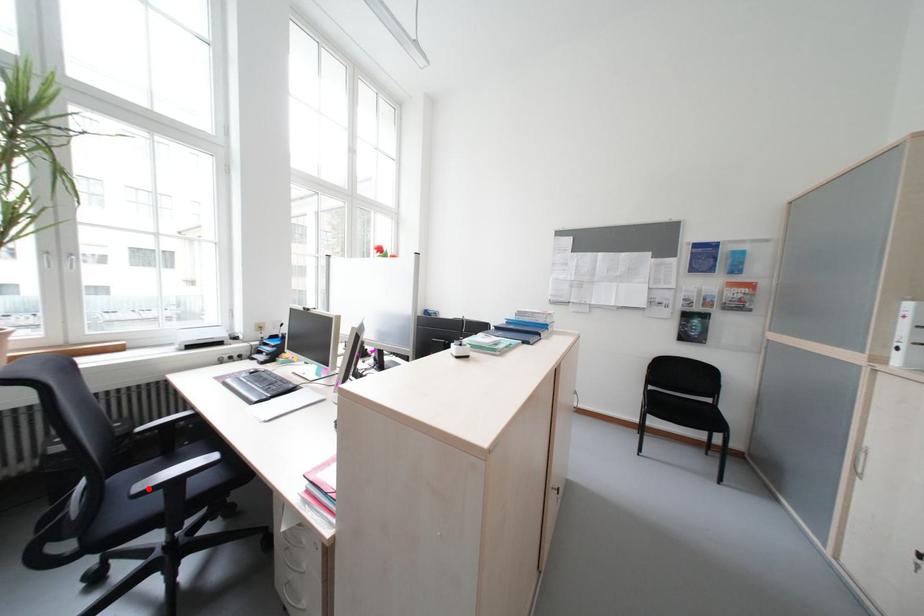
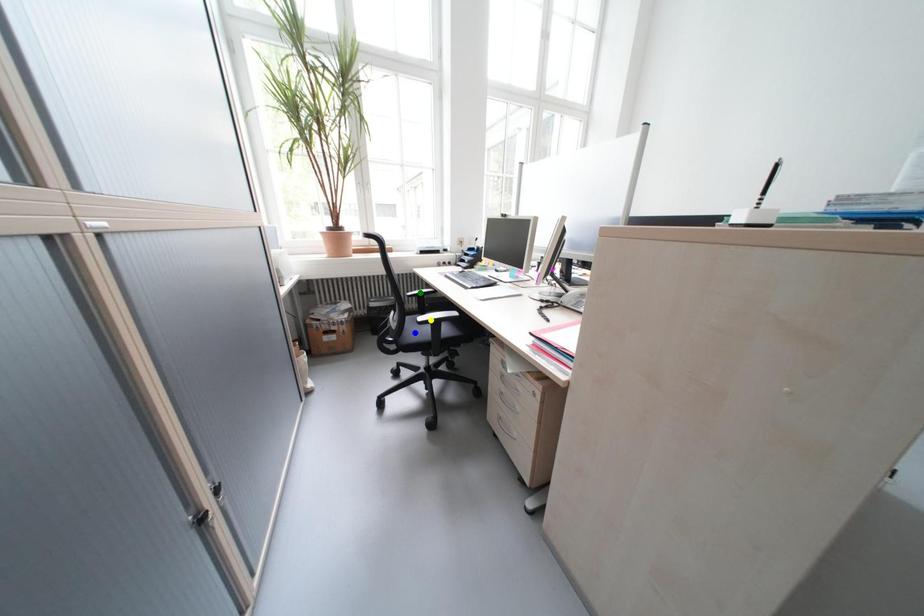
Question: I am providing you with two images of the same scene from different viewpoints. A red point is marked on the first image. You are given multiple points on the second image. Which point in image 2 represents the same 3d spot as the red point in image 1?

Choices:
 (A) green point
 (B) yellow point
 (C) blue point

Answer: (B)